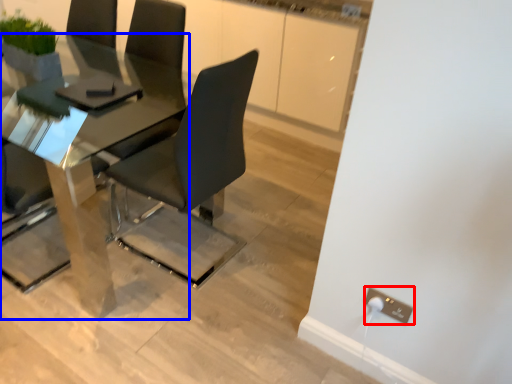
Question: Among these objects, which one is farthest to the camera, electric outlet (highlighted by a red box) or table (highlighted by a blue box)?

Choices:
 (A) electric outlet
 (B) table

Answer: (A)